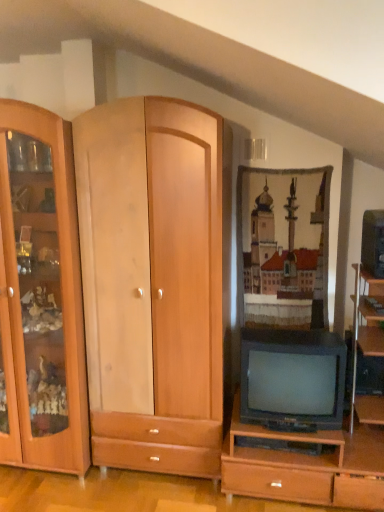
Question: Would you say matte black television at center, acting as the 1th television starting from the bottom, is inside or outside matte black television at right, placed as the second television when sorted from bottom to top?

Choices:
 (A) outside
 (B) inside

Answer: (A)

Question: In terms of size, does matte black television at center, placed as the first television when sorted from left to right, appear bigger or smaller than matte black television at right, which is the 1th television from top to bottom?

Choices:
 (A) small
 (B) big

Answer: (B)

Question: Relative to matte black television at right, which is the 1th television from top to bottom, is matte black television at center, the second television when ordered from right to left, in front or behind?

Choices:
 (A) front
 (B) behind

Answer: (B)

Question: Is matte black television at right, acting as the first television starting from the right, bigger or smaller than matte black television at center, placed as the first television when sorted from left to right?

Choices:
 (A) big
 (B) small

Answer: (B)

Question: Choose the correct answer: Is matte black television at right, acting as the first television starting from the right, inside matte black television at center, the 2th television positioned from the top, or outside it?

Choices:
 (A) outside
 (B) inside

Answer: (A)

Question: Considering the positions of matte black television at right, which is the 1th television from top to bottom, and matte black television at center, placed as the first television when sorted from left to right, in the image, is matte black television at right, which is the 1th television from top to bottom, wider or thinner than matte black television at center, placed as the first television when sorted from left to right,?

Choices:
 (A) thin
 (B) wide

Answer: (A)

Question: From the image's perspective, is matte black television at right, which is the 1th television from top to bottom, positioned above or below matte black television at center, the second television when ordered from right to left?

Choices:
 (A) above
 (B) below

Answer: (A)